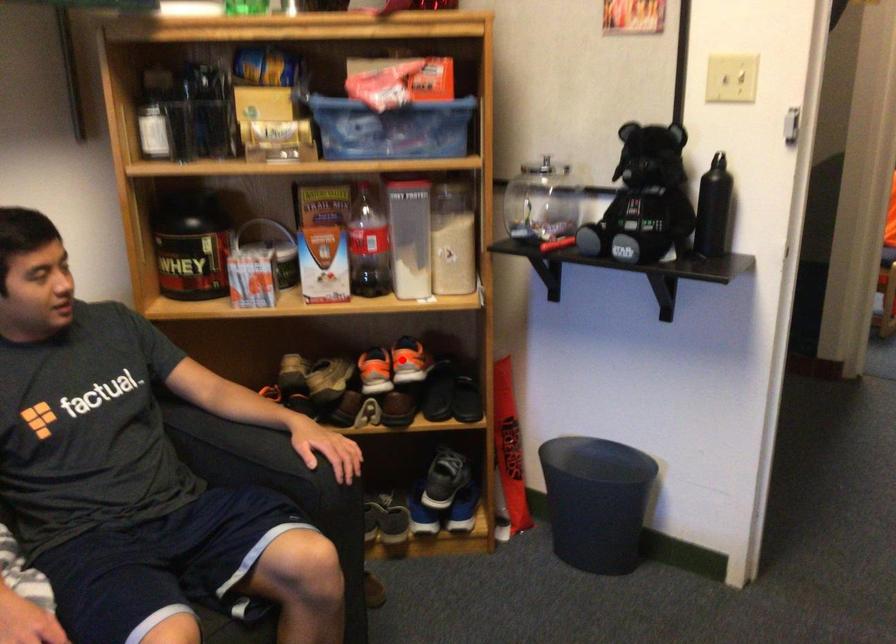
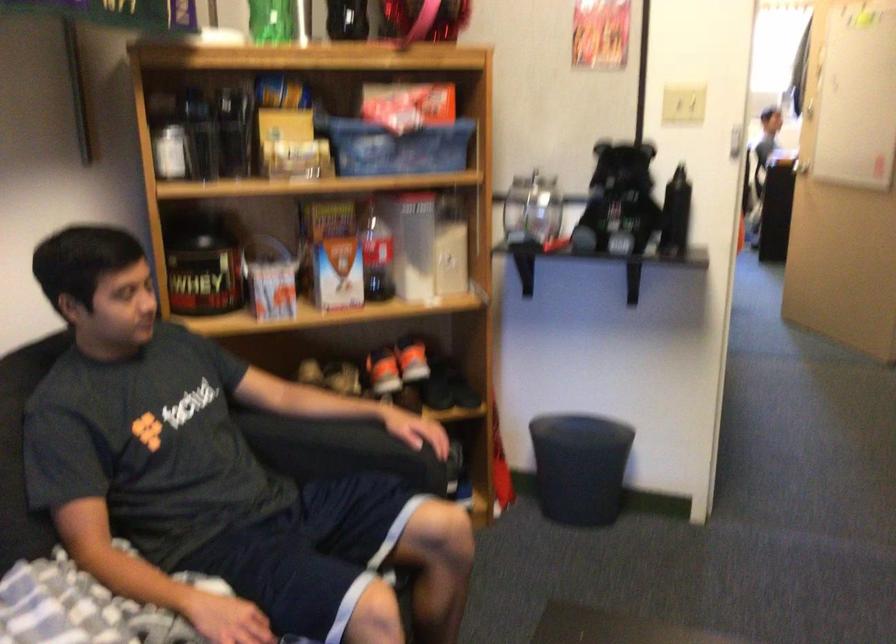
The point at the highlighted location is marked in the first image. Where is the corresponding point in the second image?

(411, 359)